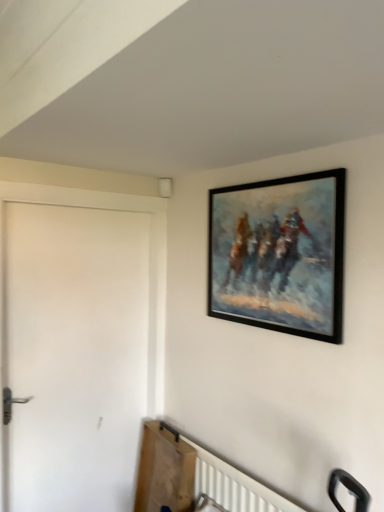
Question: From a real-world perspective, is white matte door at left positioned above or below black matte picture frame at upper right?

Choices:
 (A) below
 (B) above

Answer: (A)

Question: Is point (130, 416) closer or farther from the camera than point (253, 278)?

Choices:
 (A) farther
 (B) closer

Answer: (A)

Question: Is white matte door at left in front of or behind black matte picture frame at upper right in the image?

Choices:
 (A) behind
 (B) front

Answer: (A)

Question: Is point (299, 184) closer or farther from the camera than point (124, 347)?

Choices:
 (A) farther
 (B) closer

Answer: (B)

Question: From the image's perspective, is black matte picture frame at upper right positioned above or below white matte door at left?

Choices:
 (A) above
 (B) below

Answer: (A)

Question: Is black matte picture frame at upper right taller or shorter than white matte door at left?

Choices:
 (A) short
 (B) tall

Answer: (A)

Question: In terms of width, does black matte picture frame at upper right look wider or thinner when compared to white matte door at left?

Choices:
 (A) thin
 (B) wide

Answer: (A)